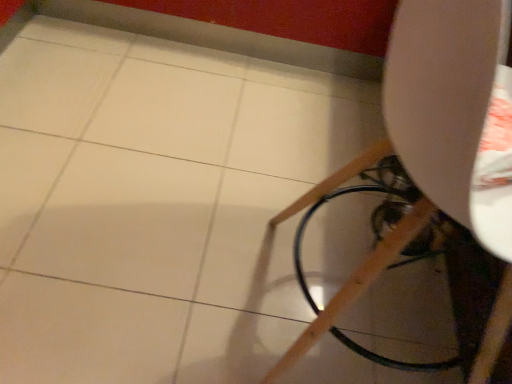
This screenshot has width=512, height=384. Identify the location of free space to the back side of matte white chair at right. (306, 181).